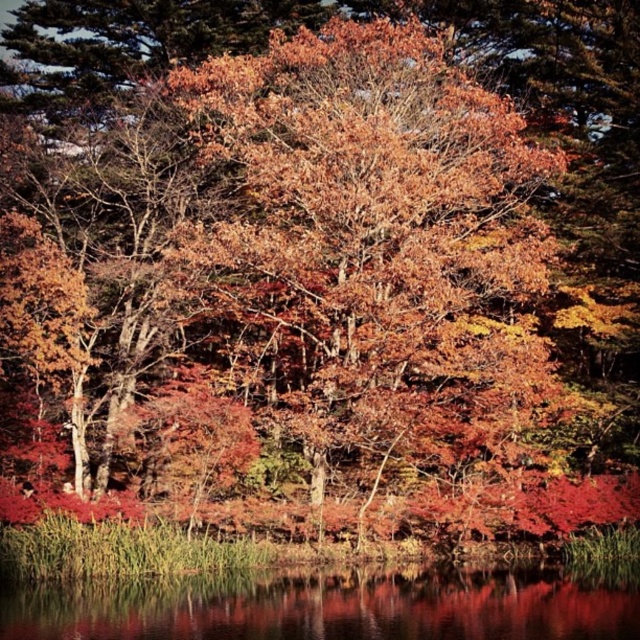
Is autumn leaves at center closer to the viewer compared to transparent water at lower center?

That is False.

Can you confirm if autumn leaves at center is wider than transparent water at lower center?

No, autumn leaves at center is not wider than transparent water at lower center.

In order to click on autumn leaves at center in this screenshot , I will do `click(371, 246)`.

I want to click on autumn leaves at center, so click(371, 246).